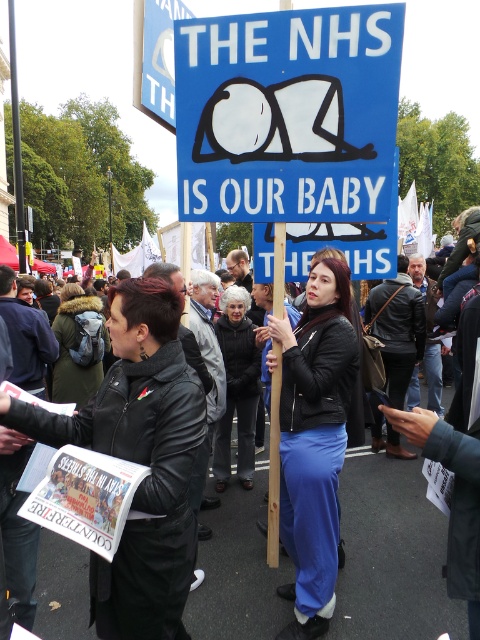
You are a photographer standing in the crowd at the protest. You want to take a closeup photo of the black leather jacket at center without moving too far. Considering your current position, is the jacket within a 3 meter range for a clear closeup?

The black leather jacket at center is 2.87 meters away from the viewer, which is within the 3 meter range, so yes, it is possible to take a clear closeup without moving too far.

You are a photographer trying to capture a clear photo of the matte black jacket at center. However, there is a blue paper sign at center in the way. Can you adjust your position to take the photo without the sign blocking the jacket?

The matte black jacket at center is behind the blue paper sign at center, so you can move your position to take the photo from behind the blue paper sign at center to capture the matte black jacket at center without obstruction.

You are a photographer trying to capture a clear shot of both the blue paper sign at center and the matte black jacket at center. Based on their positions, which object should you adjust your camera to focus on first to ensure both are in frame?

The blue paper sign at center is positioned on the left side of matte black jacket at center. To capture both in frame, focus on the matte black jacket at center first since it is on the right, allowing you to adjust the camera to include the sign on the left without moving the jacket out of view.